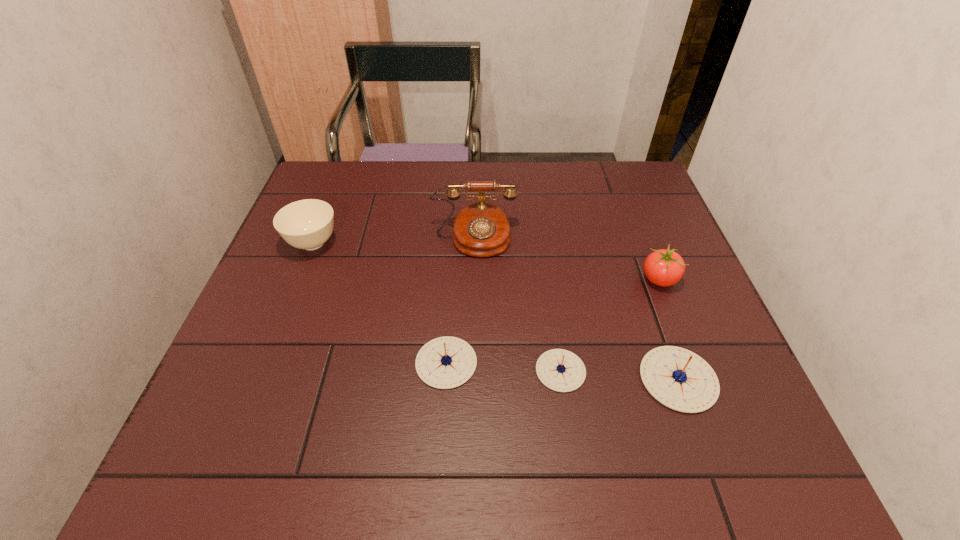
This screenshot has height=540, width=960. I want to click on the leftmost compass, so pyautogui.click(x=447, y=362).

Where is `the fifth tallest object`? Image resolution: width=960 pixels, height=540 pixels. the fifth tallest object is located at coordinates (447, 362).

At what (x,y) coordinates should I click in order to perform the action: click on the shortest object. Please return your answer as a coordinate pair (x, y). The image size is (960, 540). Looking at the image, I should click on (560, 370).

At what (x,y) coordinates should I click in order to perform the action: click on the second compass from right to left. Please return your answer as a coordinate pair (x, y). This screenshot has width=960, height=540. Looking at the image, I should click on click(560, 370).

Locate an element on the screen. the rightmost compass is located at coordinates (681, 380).

This screenshot has width=960, height=540. I want to click on the tallest object, so click(480, 230).

Where is `tomato`? The height and width of the screenshot is (540, 960). tomato is located at coordinates (663, 267).

In order to click on the leftmost object in this screenshot , I will do `click(307, 224)`.

Where is `vacant point located 0.210m on the back of the second shortest object`? vacant point located 0.210m on the back of the second shortest object is located at coordinates (452, 269).

Locate an element on the screen. free space located 0.370m on the left of the third object from right to left is located at coordinates point(353,370).